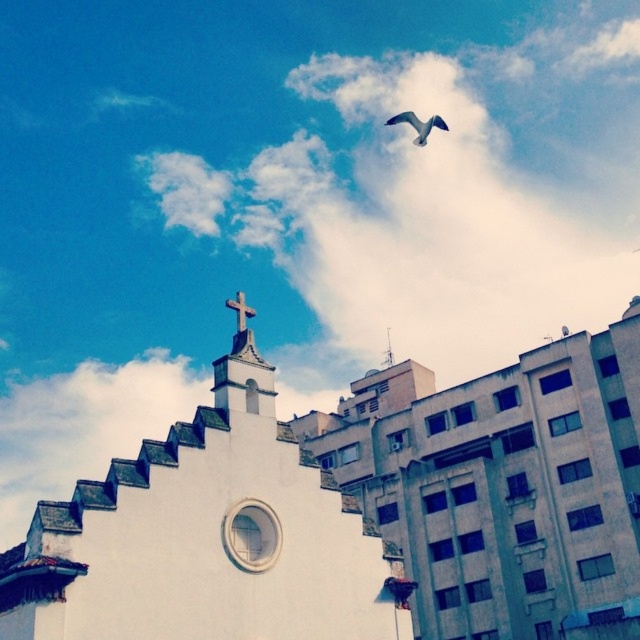
Question: Can you confirm if white matte church at upper center is wider than white fluffy cloud at upper center?

Choices:
 (A) yes
 (B) no

Answer: (B)

Question: Based on their relative distances, which object is farther from the white matte church at upper center?

Choices:
 (A) white wooden cross at upper center
 (B) white fluffy cloud at upper center

Answer: (B)

Question: Which of the following is the closest to the observer?

Choices:
 (A) white wooden cross at upper center
 (B) white fluffy cloud at upper center
 (C) white matte church at upper center

Answer: (C)

Question: Is white fluffy cloud at upper center positioned behind gray feathered bird at upper center?

Choices:
 (A) yes
 (B) no

Answer: (A)

Question: Based on their relative distances, which object is farther from the white fluffy cloud at upper center?

Choices:
 (A) white wooden cross at upper center
 (B) white matte church at upper center

Answer: (B)

Question: From the image, what is the correct spatial relationship of gray feathered bird at upper center in relation to white wooden cross at upper center?

Choices:
 (A) right
 (B) left

Answer: (A)